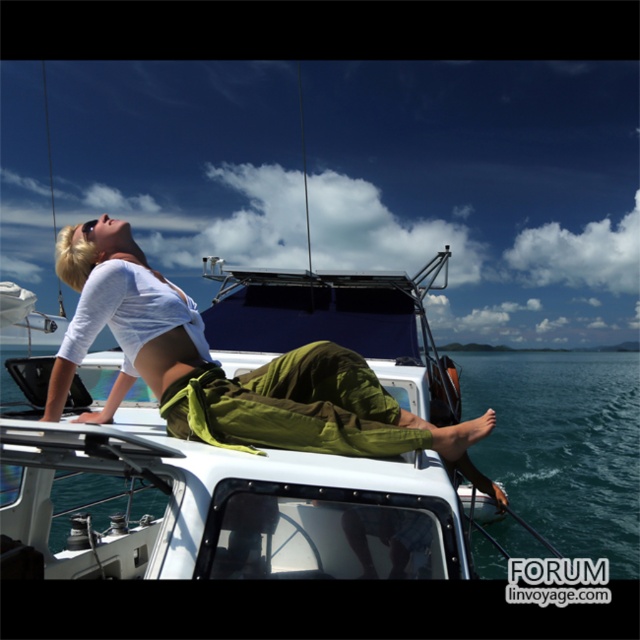
You are standing on the deck of the sailboat and see two points marked on the deck. The first point is at position point [72,230] and the second is at point [572,396]. If you want to move from the first point to the second point, which direction should you face to walk directly towards it?

Since point [72,230] is in front of point [572,396], you should face backward to walk directly towards the second point.

You are a photographer on the boat and want to capture both the matte white shirt at upper left and the clear blue water at upper center in a single frame. Which object appears narrower in the photo?

The matte white shirt at upper left appears narrower in the photo because it has a lesser width compared to the clear blue water at upper center.

You are a photographer on the boat and want to capture both the matte white shirt at upper left and the clear blue water at upper center in the same frame. Which object should you focus on first to ensure both are in focus?

You should focus on the clear blue water at upper center first because it is taller than the matte white shirt at upper left, allowing the photographer to include both in the frame by focusing on the farther object.